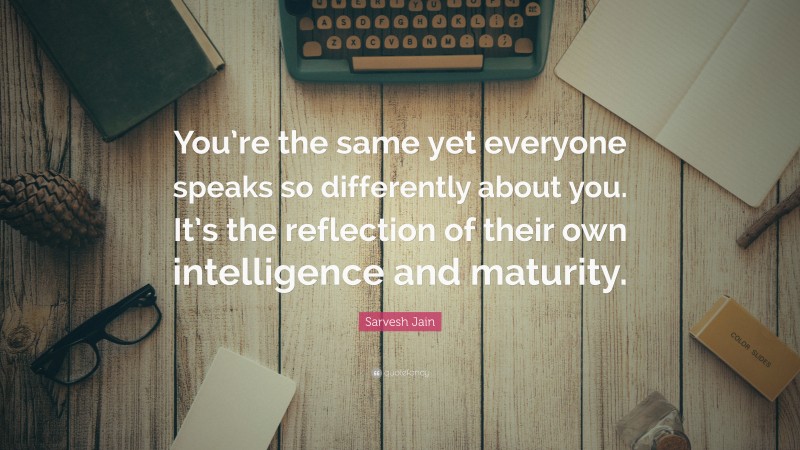
Where is `sticker`? The image size is (800, 450). sticker is located at coordinates (262, 382).